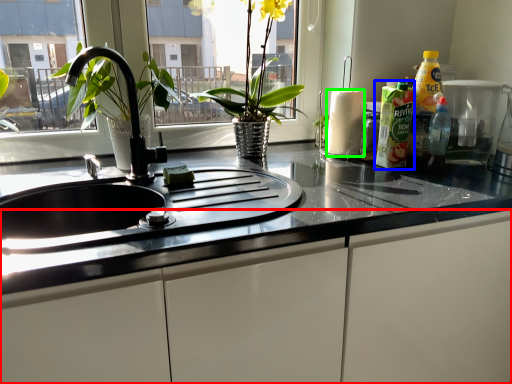
Question: Estimate the real-world distances between objects in this image. Which object is closer to cabinetry (highlighted by a red box), cleaning product (highlighted by a blue box) or paper towel (highlighted by a green box)?

Choices:
 (A) cleaning product
 (B) paper towel

Answer: (A)